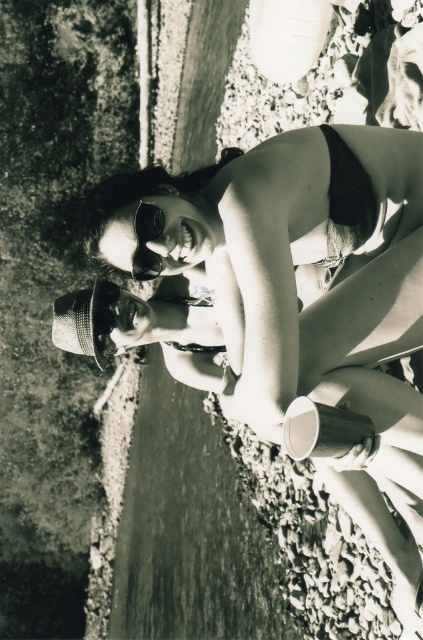
Question: Does matte black bikini at center appear on the left side of matte black goggles at center?

Choices:
 (A) yes
 (B) no

Answer: (B)

Question: Among these objects, which one is nearest to the camera?

Choices:
 (A) matte black bikini at center
 (B) matte black goggles at center

Answer: (A)

Question: Is matte black bikini at center closer to camera compared to matte black goggles at center?

Choices:
 (A) no
 (B) yes

Answer: (B)

Question: Is matte black bikini at center above matte black goggles at center?

Choices:
 (A) yes
 (B) no

Answer: (B)

Question: Which of the following is the farthest from the observer?

Choices:
 (A) matte black goggles at center
 (B) matte black bikini at center

Answer: (A)